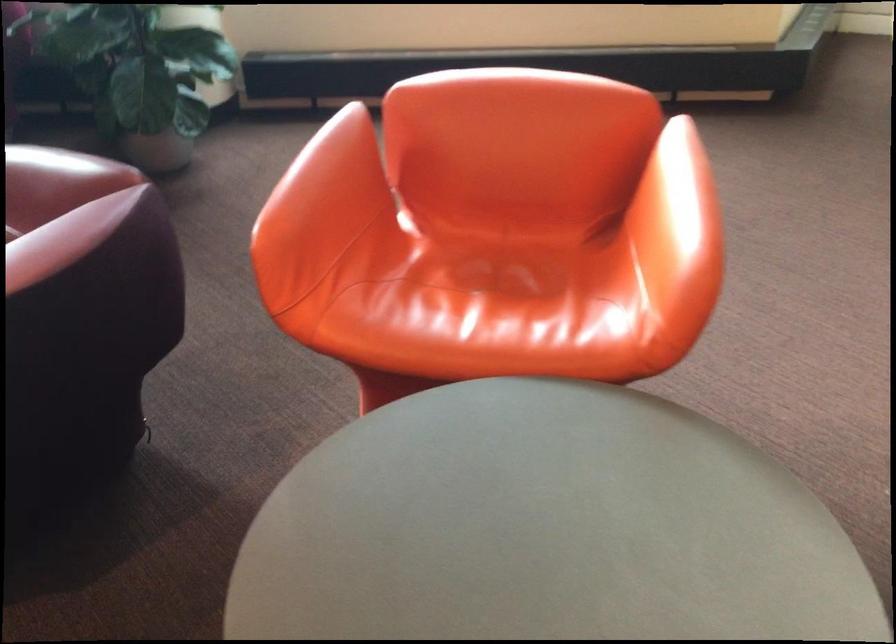
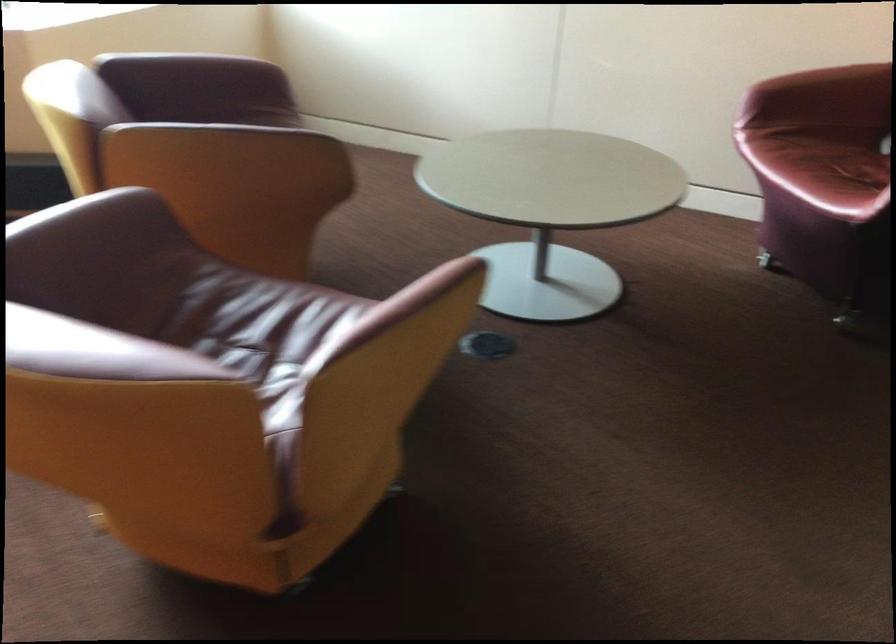
Question: The images are taken continuously from a first-person perspective. In which direction are you moving?

Choices:
 (A) Left
 (B) Right
 (C) Forward
 (D) Backward

Answer: (B)